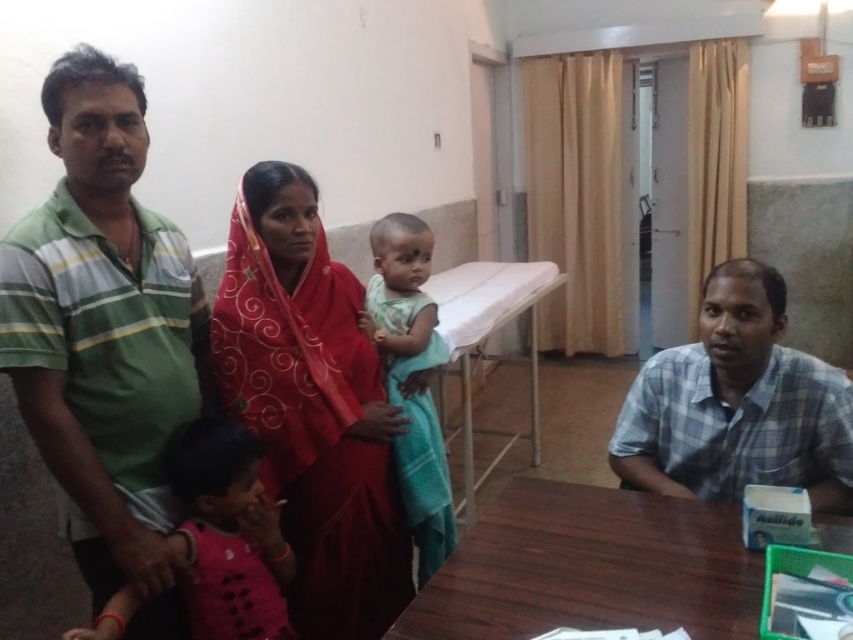
Which is in front, point (421, 612) or point (763, 394)?

Point (421, 612)

Who is lower down, brown wooden table at lower right or blue plaid shirt at right?

brown wooden table at lower right is lower down.

Between point (722, 536) and point (714, 336), which one is positioned in front?

Point (722, 536)

I want to click on brown wooden table at lower right, so click(x=590, y=566).

Can you confirm if matte green shirt at left is positioned to the left of pink fabric cloth at lower left?

Yes, matte green shirt at left is to the left of pink fabric cloth at lower left.

Is point (161, 221) positioned after point (265, 616)?

That is True.

Between point (126, 237) and point (259, 449), which one is positioned in front?

Point (126, 237) is in front.

Identify the location of matte green shirt at left. (106, 337).

Who is higher up, matte green shirt at left or blue plaid shirt at right?

matte green shirt at left is higher up.

Can you confirm if matte green shirt at left is positioned to the left of blue plaid shirt at right?

Yes, matte green shirt at left is to the left of blue plaid shirt at right.

Is point (55, 328) positioned before point (723, 355)?

Yes, point (55, 328) is closer to viewer.

Where is `matte green shirt at left`? matte green shirt at left is located at coordinates (106, 337).